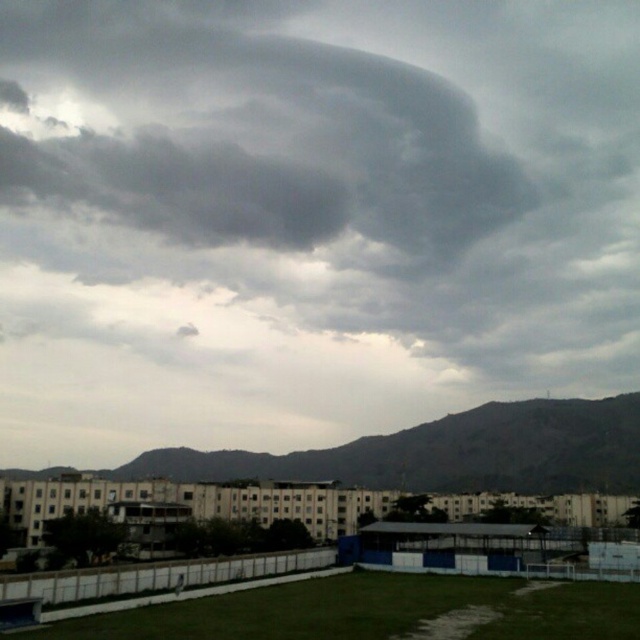
Is dark gray cloud at upper center wider than gray rocky mountain at lower center?

Indeed, dark gray cloud at upper center has a greater width compared to gray rocky mountain at lower center.

Who is more distant from viewer, (339, 81) or (481, 433)?

Positioned behind is point (339, 81).

What do you see at coordinates (244, 134) in the screenshot? This screenshot has width=640, height=640. I see `dark gray cloud at upper center` at bounding box center [244, 134].

You are a GUI agent. You are given a task and a screenshot of the screen. Output one action in this format:
    pyautogui.click(x=<x>, y=<y>)
    Task: Click on the dark gray cloud at upper center
    
    Given the screenshot: What is the action you would take?
    [244, 134]